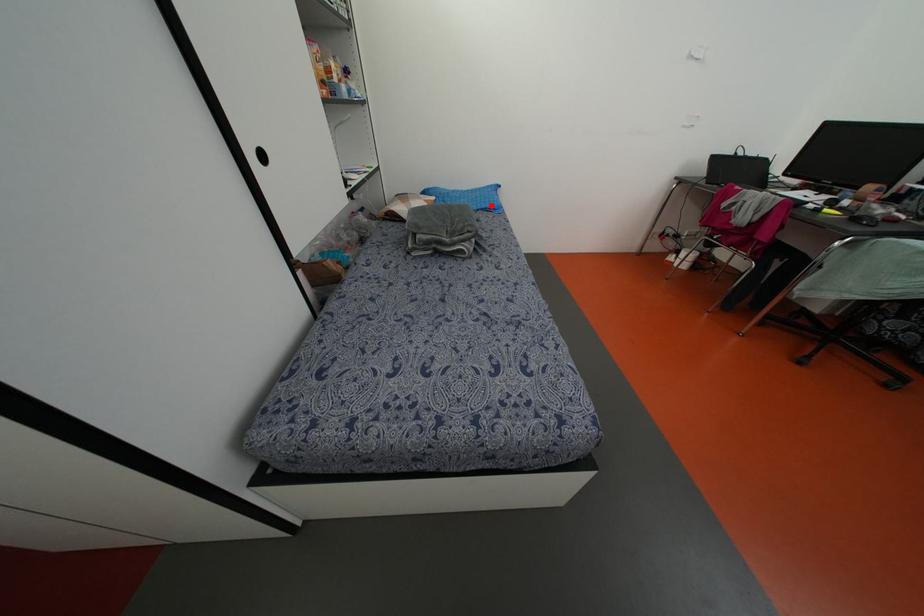
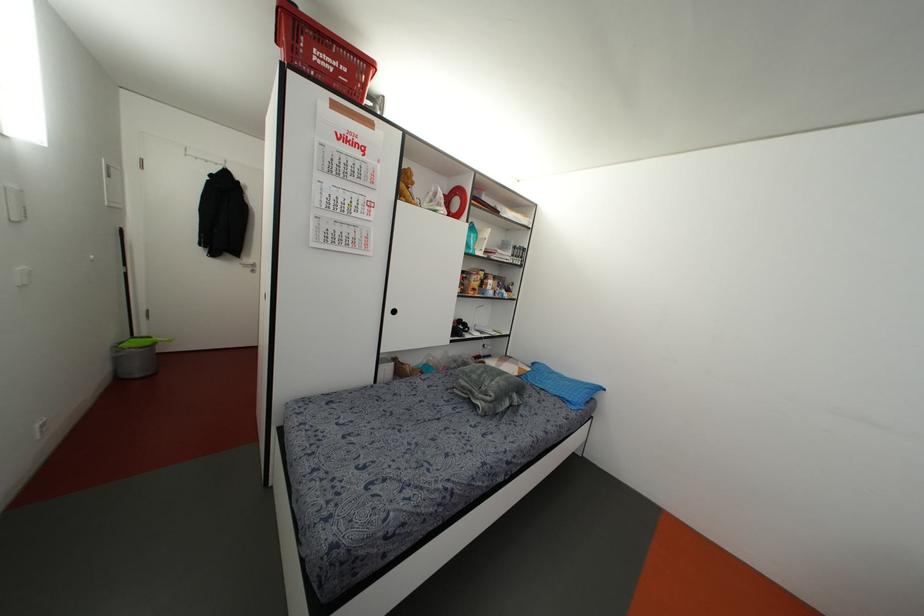
Locate, in the second image, the point that corresponds to the highlighted location in the first image.

(569, 399)